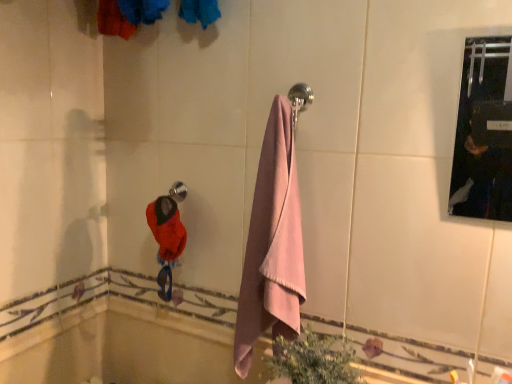
Question: Is polished chrome towel bar at upper center closer to camera compared to pink cotton towel at center?

Choices:
 (A) no
 (B) yes

Answer: (A)

Question: Is polished chrome towel bar at upper center surrounding pink cotton towel at center?

Choices:
 (A) no
 (B) yes

Answer: (A)

Question: Is polished chrome towel bar at upper center placed right next to pink cotton towel at center?

Choices:
 (A) no
 (B) yes

Answer: (A)

Question: Is polished chrome towel bar at upper center to the left of pink cotton towel at center from the viewer's perspective?

Choices:
 (A) yes
 (B) no

Answer: (A)

Question: Is polished chrome towel bar at upper center looking in the opposite direction of pink cotton towel at center?

Choices:
 (A) no
 (B) yes

Answer: (A)

Question: Is pink cotton towel at center wider or thinner than polished chrome towel bar at upper center?

Choices:
 (A) wide
 (B) thin

Answer: (A)

Question: Is pink cotton towel at center bigger or smaller than polished chrome towel bar at upper center?

Choices:
 (A) small
 (B) big

Answer: (B)

Question: From a real-world perspective, relative to polished chrome towel bar at upper center, is pink cotton towel at center vertically above or below?

Choices:
 (A) above
 (B) below

Answer: (B)

Question: Is pink cotton towel at center taller or shorter than polished chrome towel bar at upper center?

Choices:
 (A) tall
 (B) short

Answer: (A)

Question: From a real-world perspective, is green leafy plant at lower center above or below polished chrome towel bar at upper center?

Choices:
 (A) above
 (B) below

Answer: (B)

Question: Is point (288, 339) closer or farther from the camera than point (170, 195)?

Choices:
 (A) closer
 (B) farther

Answer: (A)

Question: Considering the relative positions of green leafy plant at lower center and polished chrome towel bar at upper center in the image provided, is green leafy plant at lower center to the left or to the right of polished chrome towel bar at upper center?

Choices:
 (A) right
 (B) left

Answer: (A)

Question: Which is correct: green leafy plant at lower center is inside polished chrome towel bar at upper center, or outside of it?

Choices:
 (A) outside
 (B) inside

Answer: (A)

Question: In the image, is pink cotton towel at center on the left side or the right side of green leafy plant at lower center?

Choices:
 (A) left
 (B) right

Answer: (A)

Question: Considering the positions of pink cotton towel at center and green leafy plant at lower center in the image, is pink cotton towel at center bigger or smaller than green leafy plant at lower center?

Choices:
 (A) big
 (B) small

Answer: (A)